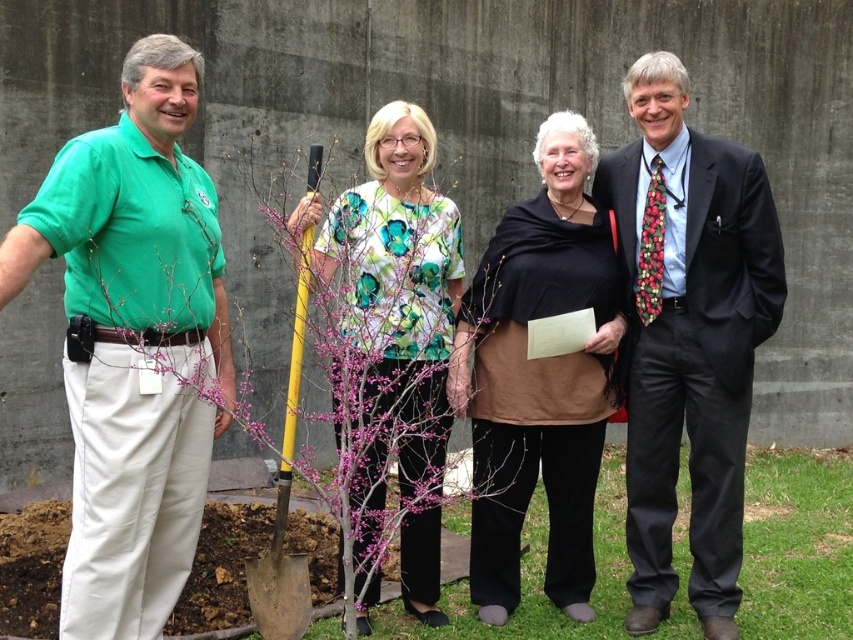
Question: Which of the following is the closest to the observer?

Choices:
 (A) black suit at center
 (B) brown matte scarf at center

Answer: (B)

Question: Estimate the real-world distances between objects in this image. Which object is closer to the black suit at center?

Choices:
 (A) brown matte scarf at center
 (B) floral printed blouse at center
 (C) yellow metal shovel at center

Answer: (A)

Question: Does black suit at center have a smaller size compared to floral printed blouse at center?

Choices:
 (A) no
 (B) yes

Answer: (B)

Question: Is floral printed blouse at center below yellow metal shovel at center?

Choices:
 (A) no
 (B) yes

Answer: (A)

Question: Does green cotton shirt at left appear under yellow metal shovel at center?

Choices:
 (A) no
 (B) yes

Answer: (A)

Question: Which object is the farthest from the green cotton shirt at left?

Choices:
 (A) bare branches at center
 (B) floral printed blouse at center
 (C) black suit at center
 (D) yellow metal shovel at center

Answer: (C)